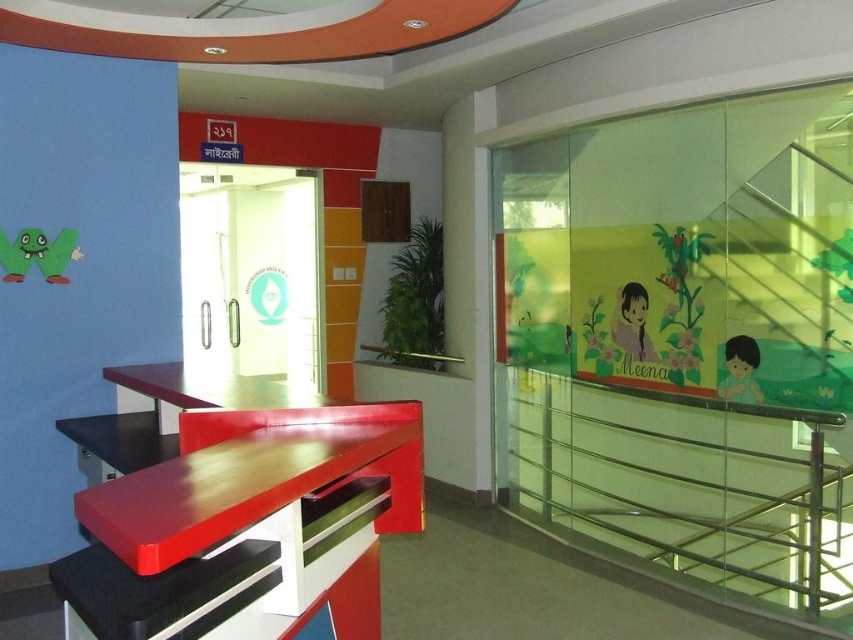
Is wooden table at center thinner than matte yellow child at right?

No.

The width and height of the screenshot is (853, 640). What do you see at coordinates (248, 529) in the screenshot? I see `wooden table at center` at bounding box center [248, 529].

This screenshot has width=853, height=640. Identify the location of wooden table at center. (248, 529).

You are a GUI agent. You are given a task and a screenshot of the screen. Output one action in this format:
    pyautogui.click(x=<x>, y=<y>)
    Task: Click on the clear glass balustrade at right
    
    Given the screenshot: What is the action you would take?
    (682, 490)

Who is higher up, clear glass balustrade at right or matte yellow child at right?

matte yellow child at right is higher up.

Who is more forward, (749, 524) or (753, 369)?

Point (753, 369)

The image size is (853, 640). I want to click on clear glass balustrade at right, so 682,490.

Is point (286, 611) farther from viewer compared to point (636, 305)?

That is False.

Describe the element at coordinates (248, 529) in the screenshot. I see `wooden table at center` at that location.

Where is `wooden table at center`? Image resolution: width=853 pixels, height=640 pixels. wooden table at center is located at coordinates (248, 529).